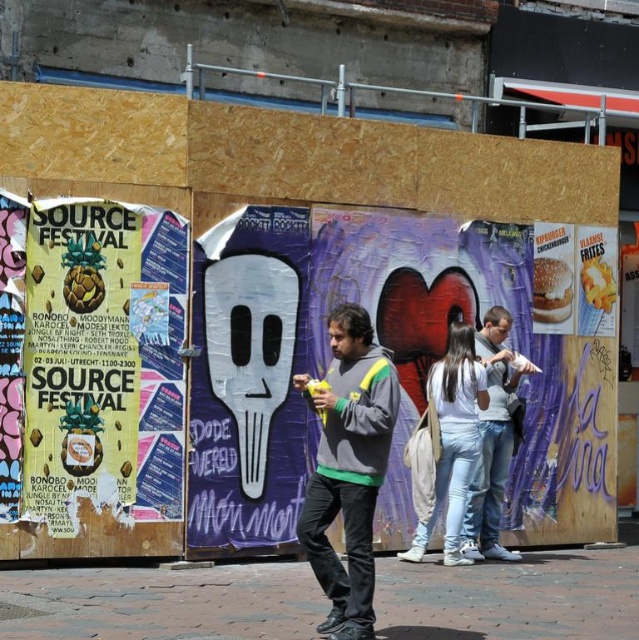
You are a fashion designer observing the urban street scene. You notice the light blue jeans at center and the white matte hoodie at center. Which clothing item is more visible to you?

The light blue jeans at center is in front of the white matte hoodie at center, so the light blue jeans at center is more visible.

You are a street artist planning to add a new sticker to the center of the wooden panel. You have two items to place there, a light blue jeans at center and a white matte hoodie at center. Which item should you choose if you want the one that takes up more horizontal space?

The light blue jeans at center has a larger width than the white matte hoodie at center, so you should choose the light blue jeans at center to take up more horizontal space.

You are a fashion designer observing the urban street scene. You notice the light blue jeans at center and the white matte hoodie at center. Which clothing item appears larger in size?

The light blue jeans at center is bigger than the white matte hoodie at center, so the light blue jeans at center appears larger in size.